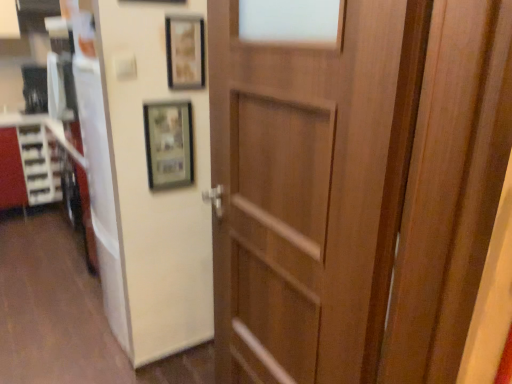
Question: Is matte white cabinet at left in front of or behind wooden frame at upper center, positioned as the second picture frame in bottom-to-top order, in the image?

Choices:
 (A) front
 (B) behind

Answer: (B)

Question: From the image's perspective, is matte white cabinet at left located above or below wooden frame at upper center, which appears as the first picture frame when viewed from the top?

Choices:
 (A) below
 (B) above

Answer: (A)

Question: Which object is positioned farthest from the matte white cabinet at left?

Choices:
 (A) wooden frame at upper center, which appears as the first picture frame when viewed from the top
 (B) matte wooden picture frame at upper center, the 1th picture frame positioned from the bottom
 (C) wooden door at center

Answer: (C)

Question: Which object is the farthest from the wooden door at center?

Choices:
 (A) wooden frame at upper center, which appears as the first picture frame when viewed from the top
 (B) matte white cabinet at left
 (C) matte wooden picture frame at upper center, the 1th picture frame positioned from the bottom

Answer: (B)